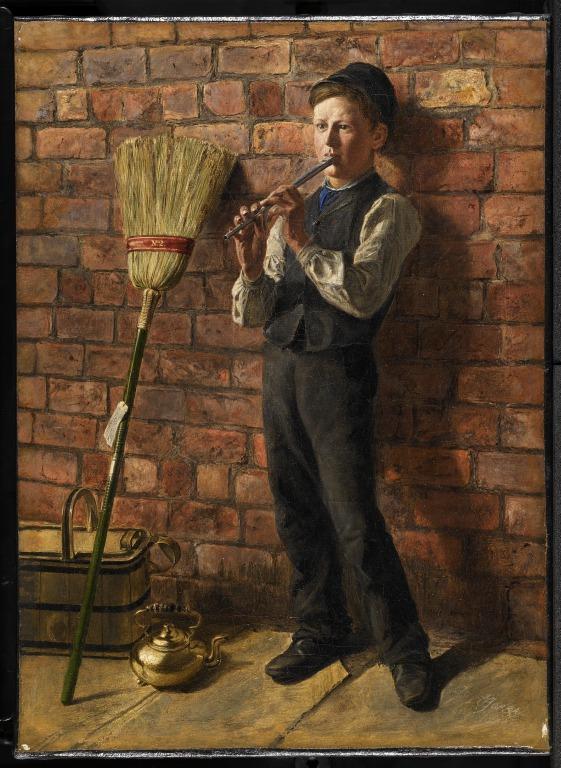
I want to click on broom, so click(x=142, y=196).